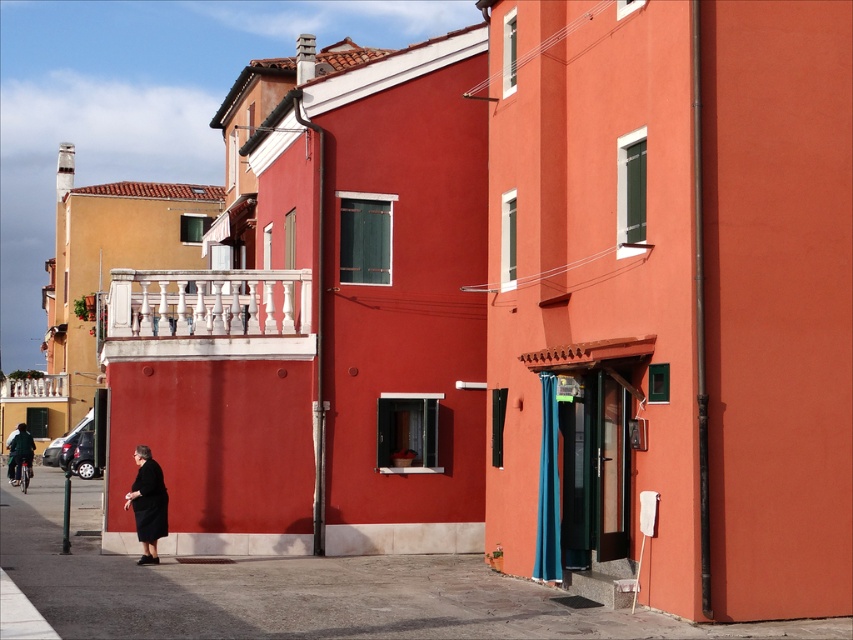
You are a delivery person trying to place a package on the smooth concrete pavement at lower center. However, there is a black matte dress at lower left in the way. Can you place the package on the pavement without moving the dress?

The smooth concrete pavement at lower center is larger than the black matte dress at lower left, so there should be enough space to place the package without moving the dress.

You are standing on the smooth concrete pavement at lower center. What is your exact 2D coordinates in the image?

Your exact 2D coordinates are at point [306,593].